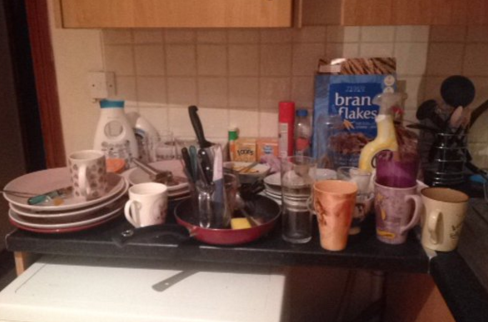
Image resolution: width=488 pixels, height=322 pixels. What are the coordinates of `countertop` in the screenshot? It's located at (285, 257), (466, 275).